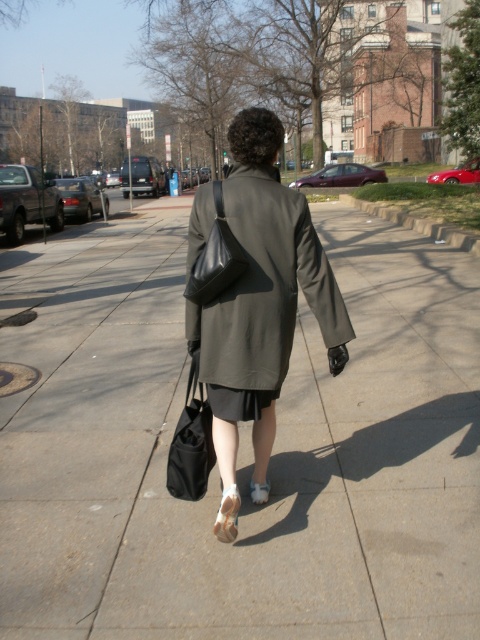
You are a delivery robot that needs to place a package on the gray concrete sidewalk at center. You are currently holding the black fabric bag at lower center. Can you safely place the package on the sidewalk without moving the bag?

The gray concrete sidewalk at center and black fabric bag at lower center are 8.20 feet apart from each other. Since the distance is sufficient, you can safely place the package on the sidewalk without moving the bag.

You are a fashion designer observing the person walking away in the image. You notice two white sandals at the lower center of the image. Which one do you think has a wider base, the white leather sandal at lower center or the white suede sandal at lower center?

The white leather sandal at lower center might be wider than the white suede sandal at lower center.